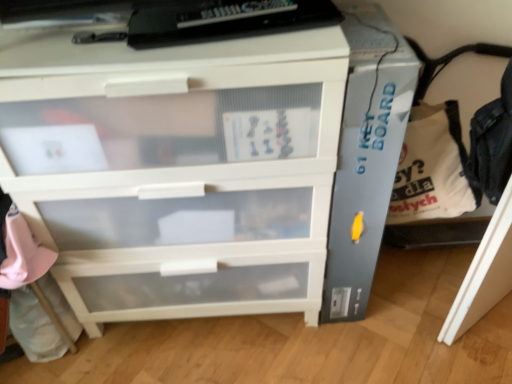
What do you see at coordinates (366, 155) in the screenshot? The height and width of the screenshot is (384, 512). I see `gray plastic file cabinet at right` at bounding box center [366, 155].

In order to face gray plastic file cabinet at right, should I rotate leftwards or rightwards?

Rotate your view right by about 12.400°.

Identify the location of gray plastic file cabinet at right. The height and width of the screenshot is (384, 512). (366, 155).

You are a GUI agent. You are given a task and a screenshot of the screen. Output one action in this format:
    pyautogui.click(x=<x>, y=<y>)
    Task: Click on the gray plastic file cabinet at right
    
    Given the screenshot: What is the action you would take?
    pyautogui.click(x=366, y=155)